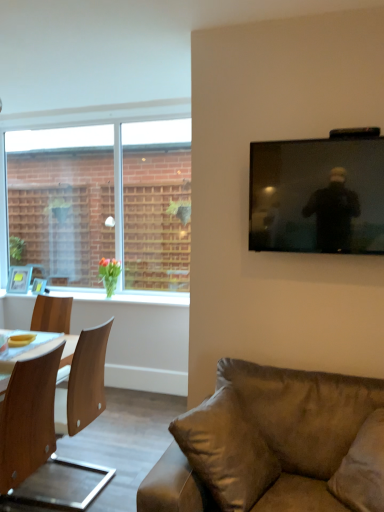
The image size is (384, 512). I want to click on blank space situated above clear glass window at upper left (from a real-world perspective), so [87, 120].